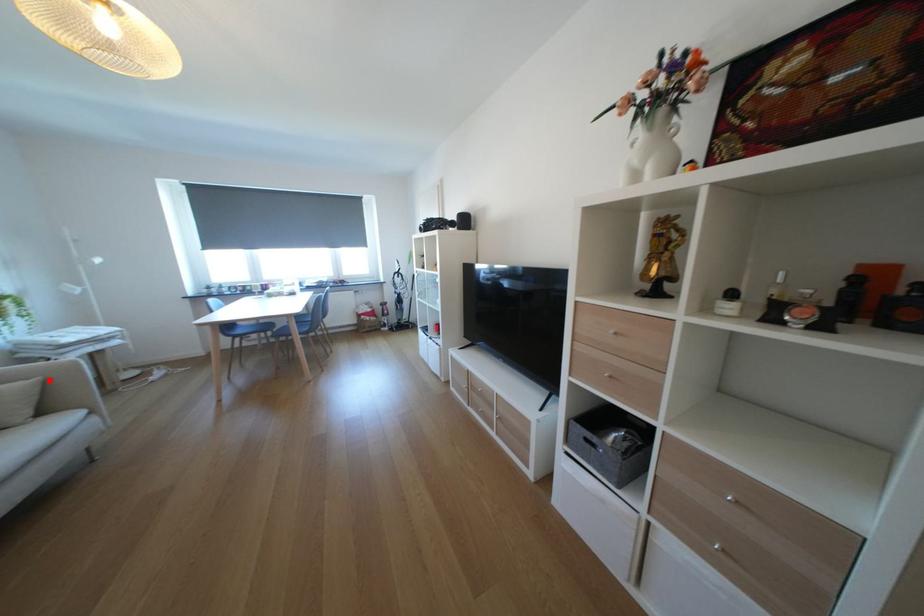
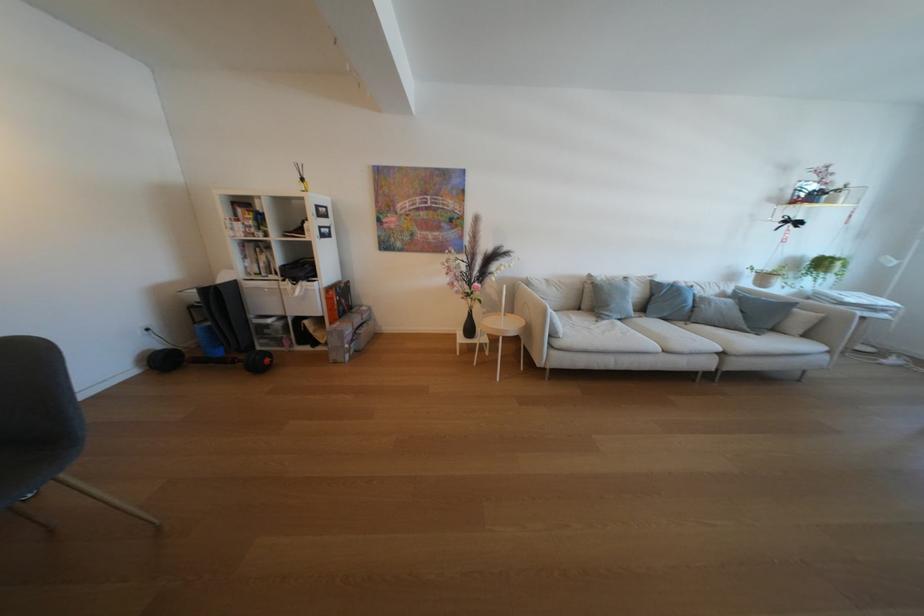
The point at the highlighted location is marked in the first image. Where is the corresponding point in the second image?

(833, 315)